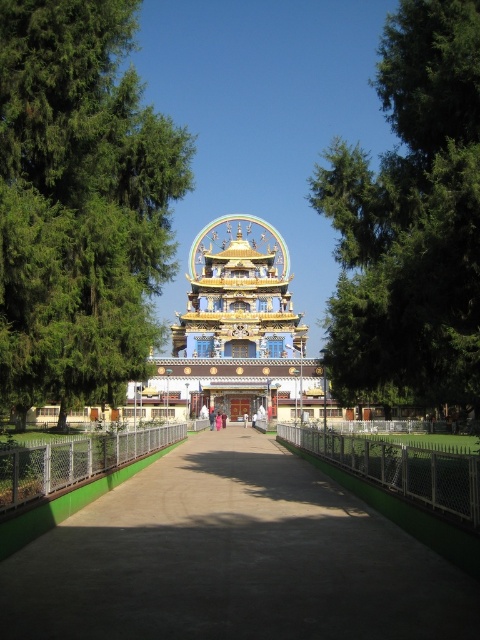
Question: Which object is positioned closest to the green concrete path at center?

Choices:
 (A) golden ornate temple at center
 (B) green leafy tree at upper left
 (C) green leafy tree at upper center

Answer: (B)

Question: Is green leafy tree at upper left to the left of golden ornate temple at center from the viewer's perspective?

Choices:
 (A) no
 (B) yes

Answer: (B)

Question: Is green concrete path at center to the right of green leafy tree at upper left from the viewer's perspective?

Choices:
 (A) no
 (B) yes

Answer: (B)

Question: Which is farther from the green leafy tree at upper center?

Choices:
 (A) green concrete path at center
 (B) green leafy tree at upper left

Answer: (A)

Question: Which point is closer to the camera?

Choices:
 (A) (101, 516)
 (B) (154, 321)

Answer: (A)

Question: From the image, what is the correct spatial relationship of green leafy tree at upper center in relation to golden ornate temple at center?

Choices:
 (A) left
 (B) right

Answer: (B)